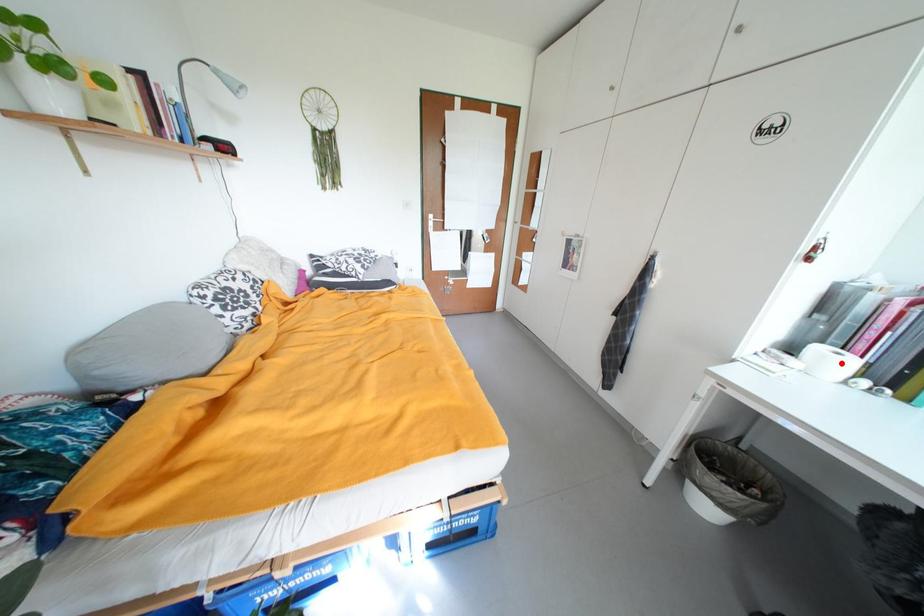
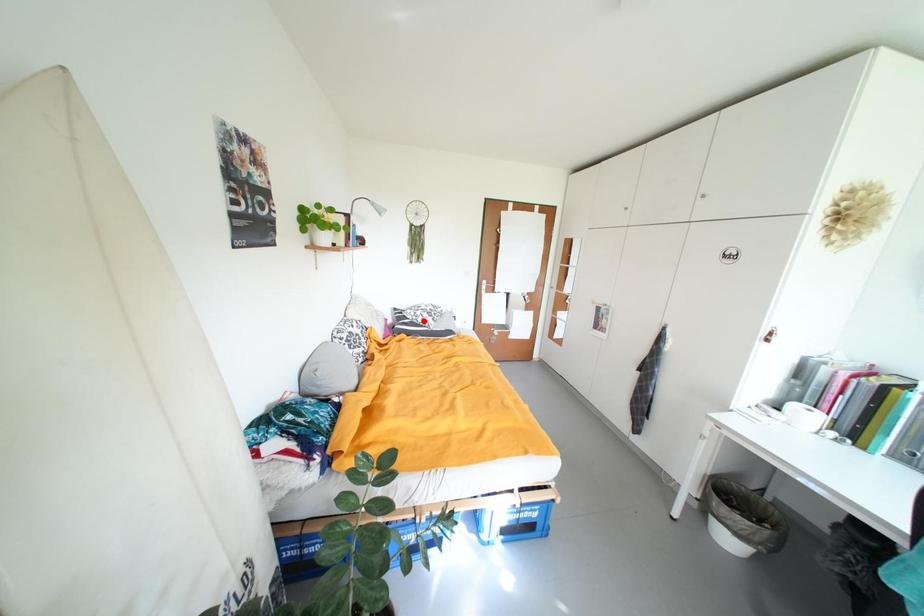
I am providing you with two images of the same scene from different viewpoints. A red point is marked on the first image and another point is marked on the second image. Are the points marked in image1 and image2 representing the same 3D position?

No